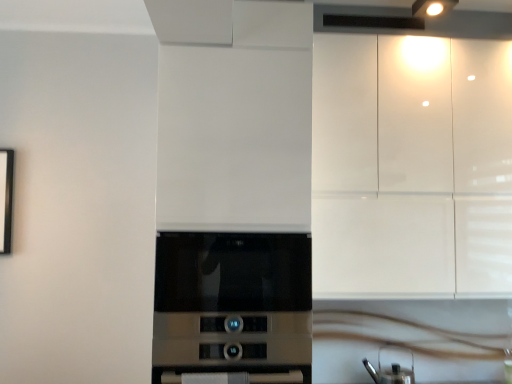
Question: Does glossy white cabinets at upper right have a smaller size compared to metallic silver kettle at lower right?

Choices:
 (A) yes
 (B) no

Answer: (B)

Question: Is glossy white cabinets at upper right not inside metallic silver kettle at lower right?

Choices:
 (A) yes
 (B) no

Answer: (A)

Question: From a real-world perspective, is glossy white cabinets at upper right positioned under metallic silver kettle at lower right based on gravity?

Choices:
 (A) no
 (B) yes

Answer: (A)

Question: From the image's perspective, is glossy white cabinets at upper right below metallic silver kettle at lower right?

Choices:
 (A) yes
 (B) no

Answer: (B)

Question: Can you confirm if glossy white cabinets at upper right is thinner than metallic silver kettle at lower right?

Choices:
 (A) no
 (B) yes

Answer: (A)

Question: Can you confirm if glossy white cabinets at upper right is taller than metallic silver kettle at lower right?

Choices:
 (A) no
 (B) yes

Answer: (B)

Question: Is glossy white cabinets at upper right further to the viewer compared to satin silver microwave at center?

Choices:
 (A) no
 (B) yes

Answer: (B)

Question: Is glossy white cabinets at upper right not near satin silver microwave at center?

Choices:
 (A) no
 (B) yes

Answer: (A)

Question: Is glossy white cabinets at upper right taller than satin silver microwave at center?

Choices:
 (A) no
 (B) yes

Answer: (B)

Question: Is glossy white cabinets at upper right not inside satin silver microwave at center?

Choices:
 (A) yes
 (B) no

Answer: (A)

Question: Does glossy white cabinets at upper right have a larger size compared to satin silver microwave at center?

Choices:
 (A) yes
 (B) no

Answer: (A)

Question: Considering the relative sizes of glossy white cabinets at upper right and satin silver microwave at center in the image provided, is glossy white cabinets at upper right smaller than satin silver microwave at center?

Choices:
 (A) yes
 (B) no

Answer: (B)

Question: Considering the relative positions of glossy white cabinets at upper right and white glossy countertop at lower center in the image provided, is glossy white cabinets at upper right to the left of white glossy countertop at lower center from the viewer's perspective?

Choices:
 (A) no
 (B) yes

Answer: (A)